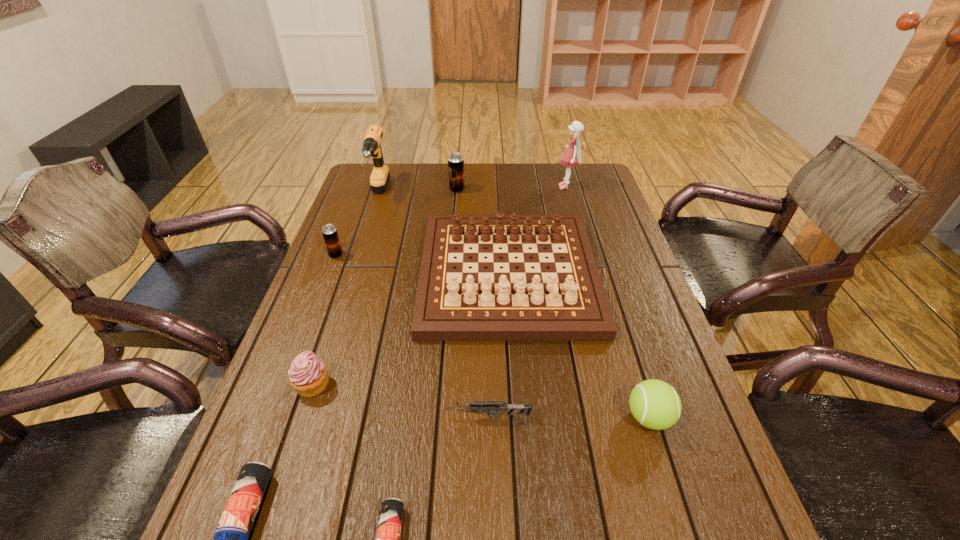
In order to click on free space located on the front-facing side of the pink doll in this screenshot , I will do `click(501, 187)`.

You are a GUI agent. You are given a task and a screenshot of the screen. Output one action in this format:
    pyautogui.click(x=<x>, y=<y>)
    Task: Click on the free point located on the front-facing side of the pink doll
    
    Given the screenshot: What is the action you would take?
    pyautogui.click(x=529, y=187)

Where is `vacant point located on the front-facing side of the pink doll`? This screenshot has height=540, width=960. vacant point located on the front-facing side of the pink doll is located at coordinates (487, 187).

I want to click on vacant space located at the tip of the drill, so (362, 245).

This screenshot has width=960, height=540. I want to click on vacant region located 0.140m on the front of the tallest beer can, so click(455, 216).

At what (x,y) coordinates should I click in order to perform the action: click on free spot located 0.310m on the side with the white pieces of the brown gameboard. Please return your answer as a coordinate pair (x, y). Looking at the image, I should click on (522, 470).

Locate an element on the screen. free space located 0.130m on the right of the second farthest beer can is located at coordinates (387, 255).

The height and width of the screenshot is (540, 960). In order to click on vacant space situated 0.380m on the left of the green tennis ball in this screenshot , I will do coord(441,417).

Locate an element on the screen. The width and height of the screenshot is (960, 540). vacant space situated on the right of the cupcake is located at coordinates (510, 386).

Where is `vacant position located 0.100m aimed along the barrel of the grey gun`? The height and width of the screenshot is (540, 960). vacant position located 0.100m aimed along the barrel of the grey gun is located at coordinates (397, 416).